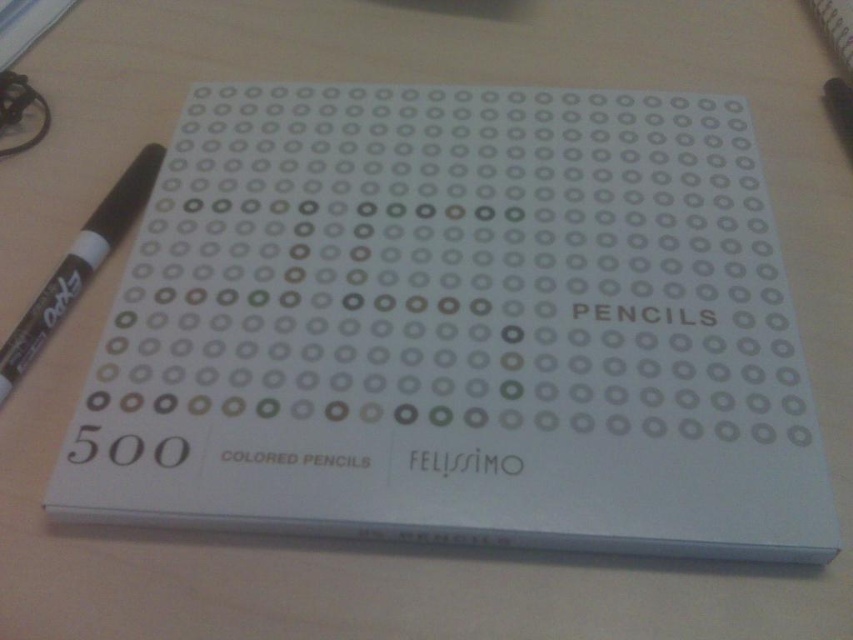
Question: Can you confirm if white matte box of colored pencils at center is positioned above black marker at left?

Choices:
 (A) no
 (B) yes

Answer: (A)

Question: Which point is closer to the camera taking this photo?

Choices:
 (A) (175, 246)
 (B) (53, 305)

Answer: (B)

Question: Which point appears closest to the camera in this image?

Choices:
 (A) (0, 390)
 (B) (329, 502)

Answer: (B)

Question: Is white matte box of colored pencils at center to the right of black marker at left from the viewer's perspective?

Choices:
 (A) no
 (B) yes

Answer: (B)

Question: Among these points, which one is nearest to the camera?

Choices:
 (A) (556, 257)
 (B) (131, 205)

Answer: (A)

Question: Can you confirm if white matte box of colored pencils at center is smaller than black marker at left?

Choices:
 (A) no
 (B) yes

Answer: (A)